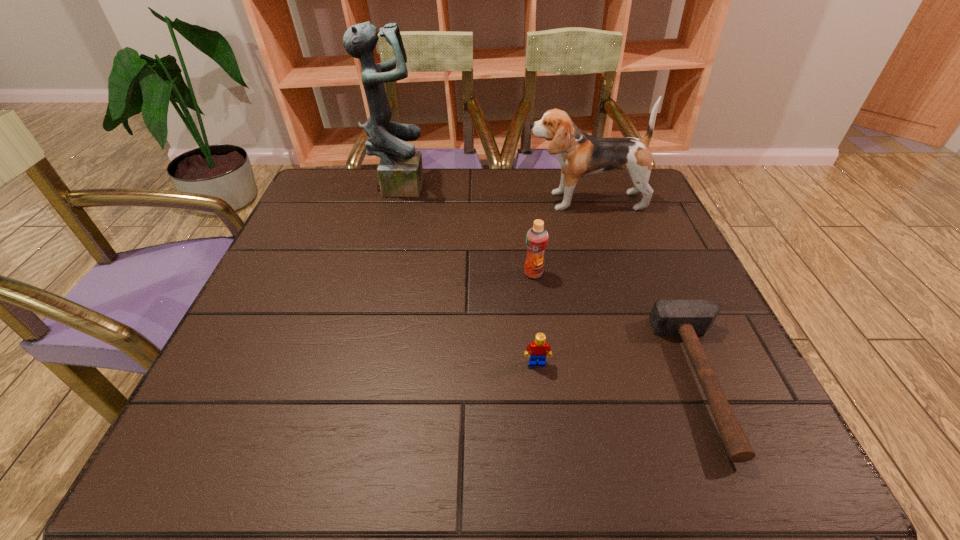
At what (x,y) coordinates should I click in order to perform the action: click on unoccupied area between the shortest object and the Lego. Please return your answer as a coordinate pair (x, y). This screenshot has height=540, width=960. Looking at the image, I should click on (622, 372).

You are a GUI agent. You are given a task and a screenshot of the screen. Output one action in this format:
    pyautogui.click(x=<x>, y=<y>)
    Task: Click on the free space between the Lego and the third shortest object
    
    Given the screenshot: What is the action you would take?
    pyautogui.click(x=536, y=318)

Where is `free spot between the second tallest object and the orange juice`? The height and width of the screenshot is (540, 960). free spot between the second tallest object and the orange juice is located at coordinates click(x=559, y=237).

Identify the location of free space between the orange juice and the second shortest object. (536, 318).

Locate an element on the screen. This screenshot has height=540, width=960. vacant area between the second shortest object and the puppy is located at coordinates (561, 282).

Locate an element on the screen. The image size is (960, 540). vacant space that is in between the shortest object and the fourth shortest object is located at coordinates (645, 291).

Locate an element on the screen. free spot between the puppy and the shortest object is located at coordinates pyautogui.click(x=645, y=291).

The image size is (960, 540). I want to click on empty location between the shortest object and the sculpture, so click(x=552, y=282).

Locate which object is the second closest to the orange juice. Please provide its 2D coordinates. Your answer should be formatted as a tuple, i.e. [(x, y)], where the tuple contains the x and y coordinates of a point satisfying the conditions above.

[(580, 155)]

The width and height of the screenshot is (960, 540). What are the coordinates of `object that is the third closest to the tallest object` in the screenshot? It's located at (538, 351).